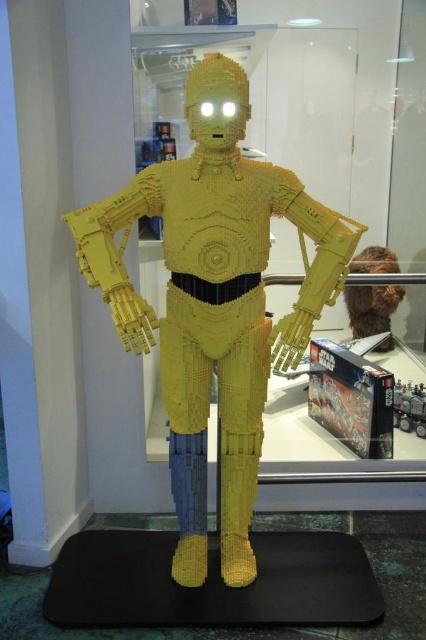
Question: Which point appears closest to the camera in this image?

Choices:
 (A) (408, 413)
 (B) (317, 304)
 (C) (388, 264)

Answer: (B)

Question: Can you confirm if yellow lego robot at center is smaller than brown fuzzy wig at upper right?

Choices:
 (A) no
 (B) yes

Answer: (A)

Question: Does brown fuzzy wig at upper right have a larger size compared to brick-like yellow robot at center?

Choices:
 (A) yes
 (B) no

Answer: (A)

Question: Is yellow lego robot at center wider than brown fuzzy wig at upper right?

Choices:
 (A) no
 (B) yes

Answer: (B)

Question: Which object is positioned farthest from the brown fuzzy wig at upper right?

Choices:
 (A) brick-like yellow robot at center
 (B) yellow lego robot at center

Answer: (B)

Question: Which object is the farthest from the brown fuzzy wig at upper right?

Choices:
 (A) yellow lego robot at center
 (B) brick-like yellow robot at center

Answer: (A)